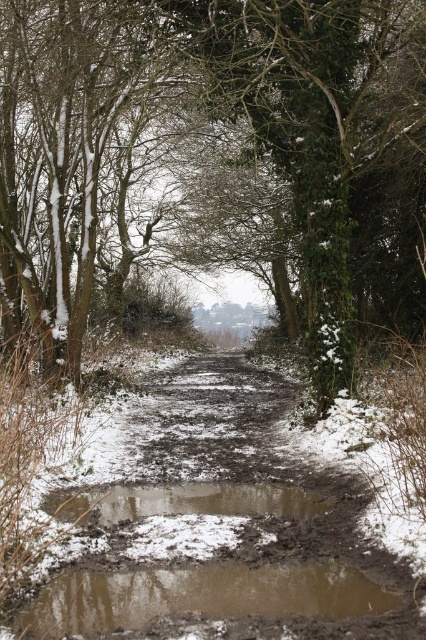
Question: Among these objects, which one is farthest from the camera?

Choices:
 (A) muddy wet path at center
 (B) brown muddy puddle at center

Answer: (B)

Question: Considering the relative positions of muddy wet path at center and brown muddy puddle at center in the image provided, where is muddy wet path at center located with respect to brown muddy puddle at center?

Choices:
 (A) below
 (B) above

Answer: (B)

Question: Which object appears farthest from the camera in this image?

Choices:
 (A) brown muddy puddle at center
 (B) muddy wet path at center

Answer: (A)

Question: Does muddy wet path at center have a greater width compared to brown muddy puddle at center?

Choices:
 (A) yes
 (B) no

Answer: (A)

Question: Is muddy wet path at center to the left of brown muddy puddle at center from the viewer's perspective?

Choices:
 (A) no
 (B) yes

Answer: (A)

Question: Among these objects, which one is nearest to the camera?

Choices:
 (A) muddy wet path at center
 (B) brown muddy puddle at center

Answer: (A)